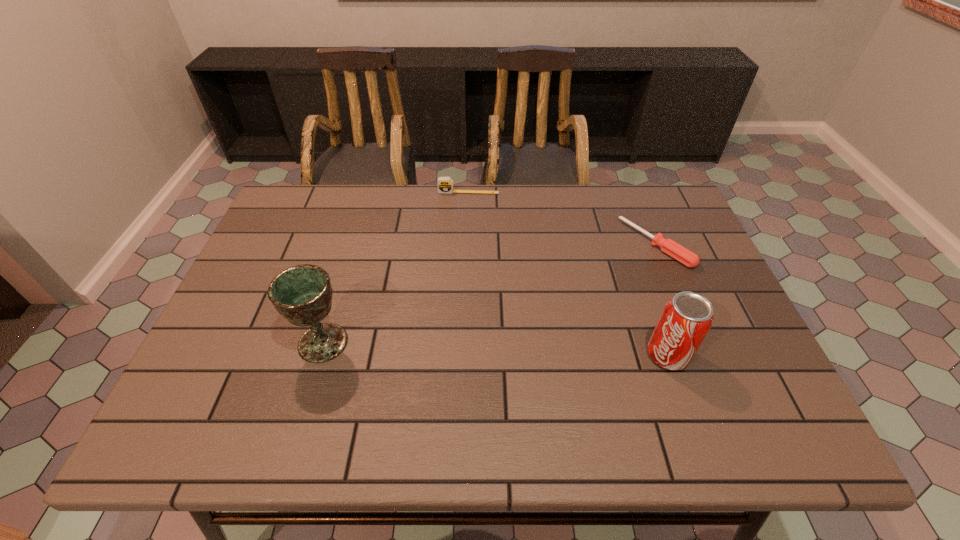
The height and width of the screenshot is (540, 960). I want to click on the leftmost object, so click(x=302, y=294).

The height and width of the screenshot is (540, 960). Identify the location of the third shortest object. (686, 319).

Where is `screwdriver`? This screenshot has height=540, width=960. screwdriver is located at coordinates (681, 254).

Locate an element on the screen. This screenshot has height=540, width=960. the shortest object is located at coordinates (681, 254).

At what (x,y) coordinates should I click in order to perform the action: click on the third tallest object. Please return your answer as a coordinate pair (x, y). Looking at the image, I should click on (445, 184).

I want to click on the third object from right to left, so click(445, 184).

Identify the location of blank space located 0.230m on the back of the leftmost object. (348, 257).

Find the location of a particular element. The width and height of the screenshot is (960, 540). vacant region located 0.070m on the left of the second tallest object is located at coordinates (616, 355).

Where is `vacant space positioned at the tip of the shortest object`? The image size is (960, 540). vacant space positioned at the tip of the shortest object is located at coordinates (578, 302).

I want to click on vacant space located 0.260m at the tip of the shortest object, so click(572, 306).